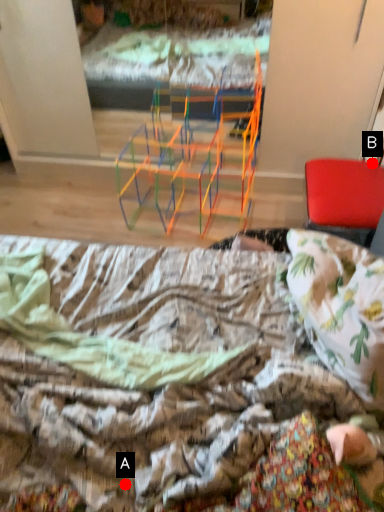
Question: Two points are circled on the image, labeled by A and B beside each circle. Which point appears farthest from the camera in this image?

Choices:
 (A) A is further
 (B) B is further

Answer: (B)